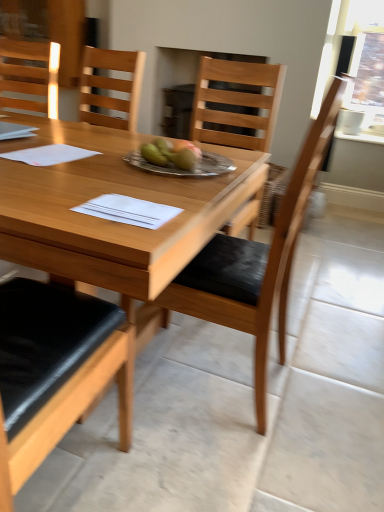
This screenshot has height=512, width=384. I want to click on wooden table at center, so click(x=107, y=220).

The width and height of the screenshot is (384, 512). Describe the element at coordinates (129, 211) in the screenshot. I see `white paper at center` at that location.

The image size is (384, 512). What do you see at coordinates (185, 170) in the screenshot?
I see `silver metallic plate at center` at bounding box center [185, 170].

The height and width of the screenshot is (512, 384). What do you see at coordinates (30, 75) in the screenshot?
I see `matte wood chair at upper left, which appears as the 2th chair when ordered from the bottom` at bounding box center [30, 75].

Locate an element on the screen. This screenshot has width=384, height=512. wooden table at center is located at coordinates (107, 220).

Which of these two, white paper at center or matte wood chair at upper left, which appears as the 1th chair when viewed from the left, is wider?

matte wood chair at upper left, which appears as the 1th chair when viewed from the left, is wider.

In terms of size, does white paper at center appear bigger or smaller than matte wood chair at upper left, which appears as the 2th chair when ordered from the bottom?

In the image, white paper at center appears to be smaller than matte wood chair at upper left, which appears as the 2th chair when ordered from the bottom.

Based on the photo, from a real-world perspective, is white paper at center positioned above or below matte wood chair at upper left, the second chair viewed from the right?

white paper at center is below matte wood chair at upper left, the second chair viewed from the right.

Can matte wood chair at upper left, the second chair viewed from the right, be found inside white paper at center?

No, matte wood chair at upper left, the second chair viewed from the right, is located outside of white paper at center.

Considering the positions of points (155, 216) and (228, 286), is point (155, 216) closer to camera compared to point (228, 286)?

Yes, point (155, 216) is in front of point (228, 286).

Can you confirm if white paper at center is wider than wooden chair at center, arranged as the 2th chair when viewed from the back?

In fact, white paper at center might be narrower than wooden chair at center, arranged as the 2th chair when viewed from the back.

Where is `notebook above the wooden chair at center, marked as the second chair in a top-to-bottom arrangement (from a real-world perspective)`? This screenshot has width=384, height=512. notebook above the wooden chair at center, marked as the second chair in a top-to-bottom arrangement (from a real-world perspective) is located at coordinates [x=129, y=211].

How different are the orientations of white paper at center and wooden chair at center, marked as the second chair in a top-to-bottom arrangement, in degrees?

There is a 90.1-degree angle between the facing directions of white paper at center and wooden chair at center, marked as the second chair in a top-to-bottom arrangement.

How different are the orientations of wooden chair at center, the first chair ordered from the bottom, and silver metallic plate at center in degrees?

The angle between the facing direction of wooden chair at center, the first chair ordered from the bottom, and the facing direction of silver metallic plate at center is 90.1 degrees.

Is wooden chair at center, the 2th chair in the left-to-right sequence, inside or outside of silver metallic plate at center?

wooden chair at center, the 2th chair in the left-to-right sequence, lies outside silver metallic plate at center.

Which object is thinner, wooden chair at center, arranged as the 2th chair when viewed from the back, or silver metallic plate at center?

silver metallic plate at center is thinner.

Is point (235, 298) closer or farther from the camera than point (187, 176)?

Point (235, 298) appears to be closer to the viewer than point (187, 176).

Locate an element on the screen. The height and width of the screenshot is (512, 384). plate lying in front of the matte wood chair at upper left, the second chair viewed from the right is located at coordinates (185, 170).

Is silver metallic plate at center oriented away from matte wood chair at upper left, placed as the first chair when sorted from top to bottom?

No, silver metallic plate at center's orientation is not away from matte wood chair at upper left, placed as the first chair when sorted from top to bottom.

Based on the photo, is silver metallic plate at center placed right next to matte wood chair at upper left, the first chair viewed from the back?

No.

Which of these two, wooden chair at center, the 1th chair from the front, or matte wood chair at upper left, the second chair viewed from the right, is thinner?

matte wood chair at upper left, the second chair viewed from the right.

Considering the positions of objects wooden chair at center, which appears as the 1th chair when viewed from the right, and matte wood chair at upper left, the second chair viewed from the right, in the image provided, who is more to the right, wooden chair at center, which appears as the 1th chair when viewed from the right, or matte wood chair at upper left, the second chair viewed from the right,?

Positioned to the right is wooden chair at center, which appears as the 1th chair when viewed from the right.

Between wooden chair at center, which appears as the 1th chair when viewed from the right, and matte wood chair at upper left, which appears as the 1th chair when viewed from the left, which one has larger size?

wooden chair at center, which appears as the 1th chair when viewed from the right.

From a real-world perspective, who is located lower, wooden chair at center, the 1th chair from the front, or matte wood chair at upper left, the first chair viewed from the back?

wooden chair at center, the 1th chair from the front.

Is wooden table at center at the right side of matte wood chair at upper left, the first chair viewed from the back?

Yes.

How many degrees apart are the facing directions of wooden table at center and matte wood chair at upper left, which appears as the 2th chair when ordered from the bottom?

The angle between the facing direction of wooden table at center and the facing direction of matte wood chair at upper left, which appears as the 2th chair when ordered from the bottom, is 93.8 degrees.

From the picture: Is wooden table at center with matte wood chair at upper left, the second chair viewed from the right?

wooden table at center and matte wood chair at upper left, the second chair viewed from the right, are clearly separated.

Between wooden table at center and matte wood chair at upper left, the first chair viewed from the back, which one has larger width?

wooden table at center is wider.

From the image's perspective, is matte wood chair at upper left, the first chair viewed from the back, above or below wooden chair at center, marked as the second chair in a top-to-bottom arrangement?

Based on their image positions, matte wood chair at upper left, the first chair viewed from the back, is located above wooden chair at center, marked as the second chair in a top-to-bottom arrangement.

Is matte wood chair at upper left, placed as the first chair when sorted from top to bottom, to the right of wooden chair at center, the 1th chair from the front, from the viewer's perspective?

Incorrect, matte wood chair at upper left, placed as the first chair when sorted from top to bottom, is not on the right side of wooden chair at center, the 1th chair from the front.

The image size is (384, 512). Find the location of `notebook on the right of matte wood chair at upper left, which appears as the 1th chair when viewed from the left`. notebook on the right of matte wood chair at upper left, which appears as the 1th chair when viewed from the left is located at coordinates (129, 211).

I want to click on chair beneath the white paper at center (from a real-world perspective), so click(x=254, y=262).

Based on their spatial positions, is wooden table at center or silver metallic plate at center further from matte wood chair at upper left, which appears as the 2th chair when ordered from the bottom?

silver metallic plate at center is further to matte wood chair at upper left, which appears as the 2th chair when ordered from the bottom.

Estimate the real-world distances between objects in this image. Which object is closer to matte wood chair at upper left, which appears as the 2th chair when ordered from the bottom, wooden chair at center, the 2th chair in the left-to-right sequence, or silver metallic plate at center?

The object closer to matte wood chair at upper left, which appears as the 2th chair when ordered from the bottom, is silver metallic plate at center.

Considering their positions, is wooden chair at center, marked as the second chair in a top-to-bottom arrangement, positioned closer to matte wood chair at upper left, the second chair in the front-to-back sequence, than wooden table at center?

Among the two, wooden table at center is located nearer to matte wood chair at upper left, the second chair in the front-to-back sequence.

Which object lies further to the anchor point silver metallic plate at center, matte wood chair at upper left, placed as the first chair when sorted from top to bottom, or white paper at center?

Based on the image, matte wood chair at upper left, placed as the first chair when sorted from top to bottom, appears to be further to silver metallic plate at center.

From the image, which object appears to be farther from white paper at center, matte wood chair at upper left, which appears as the 2th chair when ordered from the bottom, or wooden chair at center, the 1th chair from the front?

matte wood chair at upper left, which appears as the 2th chair when ordered from the bottom, lies further to white paper at center than the other object.

Looking at the image, which one is located further to silver metallic plate at center, white paper at center or matte wood chair at upper left, which appears as the 2th chair when ordered from the bottom?

matte wood chair at upper left, which appears as the 2th chair when ordered from the bottom, lies further to silver metallic plate at center than the other object.

Estimate the real-world distances between objects in this image. Which object is further from silver metallic plate at center, wooden chair at center, marked as the second chair in a top-to-bottom arrangement, or white paper at center?

Based on the image, wooden chair at center, marked as the second chair in a top-to-bottom arrangement, appears to be further to silver metallic plate at center.

Looking at the image, which one is located closer to matte wood chair at upper left, which appears as the 1th chair when viewed from the left, wooden table at center or wooden chair at center, marked as the second chair in a top-to-bottom arrangement?

wooden table at center is closer to matte wood chair at upper left, which appears as the 1th chair when viewed from the left.

I want to click on notebook between matte wood chair at upper left, the second chair viewed from the right, and silver metallic plate at center, so click(x=129, y=211).

At what (x,y) coordinates should I click in order to perform the action: click on plate between matte wood chair at upper left, which appears as the 1th chair when viewed from the left, and wooden chair at center, which appears as the 1th chair when viewed from the right, in the horizontal direction. Please return your answer as a coordinate pair (x, y). This screenshot has height=512, width=384. Looking at the image, I should click on (185, 170).

The image size is (384, 512). Identify the location of notebook between wooden chair at center, the 2th chair in the left-to-right sequence, and matte wood chair at upper left, which appears as the 2th chair when ordered from the bottom, along the z-axis. (129, 211).

What are the coordinates of `notebook located between wooden table at center and matte wood chair at upper left, placed as the first chair when sorted from top to bottom, in the depth direction` in the screenshot? It's located at (129, 211).